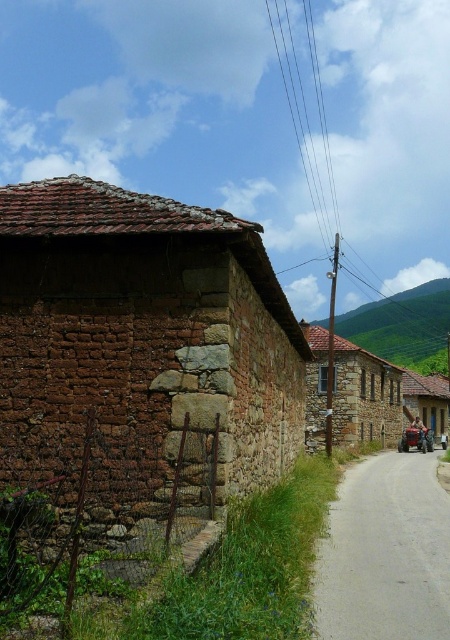
You are standing at the entrance of the village and want to find the brown stone hut at center. According to the coordinates provided, in which direction should you head from your current position to reach it?

The brown stone hut at center is located at point (364, 396). Since coordinates typically represent x and y values where higher x values move right and higher y values move forward, you should move forward and slightly to the right from your current position to reach the brown stone hut at center.

You are a painter planning to paint the brown stone wall at left and the rustic wooden cart at right. Which object requires more horizontal space on your canvas?

The rustic wooden cart at right requires more horizontal space on the canvas because it has a greater width than the brown stone wall at left.